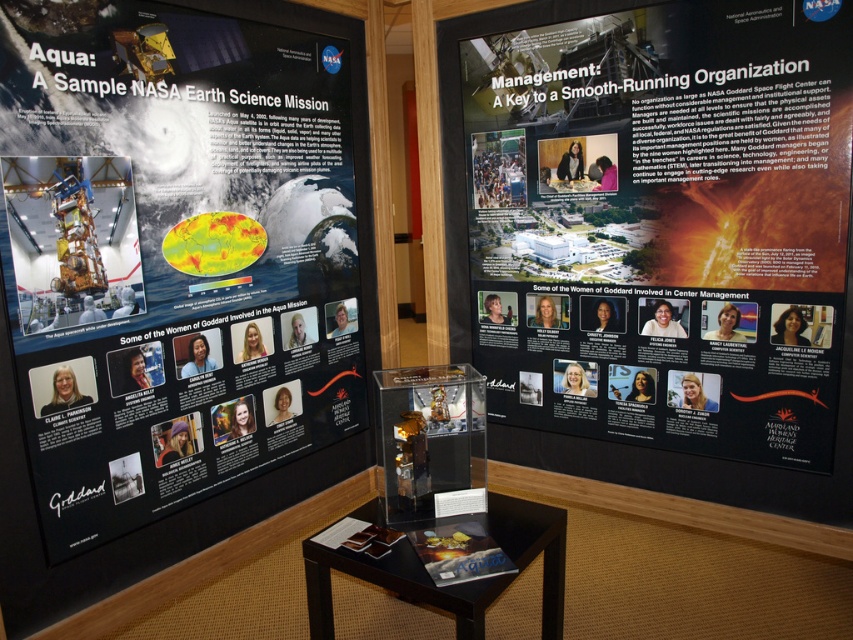
Question: Does matte black poster at left appear over matte black poster at center?

Choices:
 (A) no
 (B) yes

Answer: (A)

Question: Which of the following is the closest to the observer?

Choices:
 (A) (674, 280)
 (B) (314, 184)

Answer: (A)

Question: Can you confirm if matte black poster at left is smaller than matte black poster at center?

Choices:
 (A) no
 (B) yes

Answer: (B)

Question: From the image, what is the correct spatial relationship of matte black poster at left in relation to matte black poster at center?

Choices:
 (A) above
 (B) below

Answer: (B)

Question: Which point is closer to the camera taking this photo?

Choices:
 (A) (204, 337)
 (B) (526, 301)

Answer: (A)